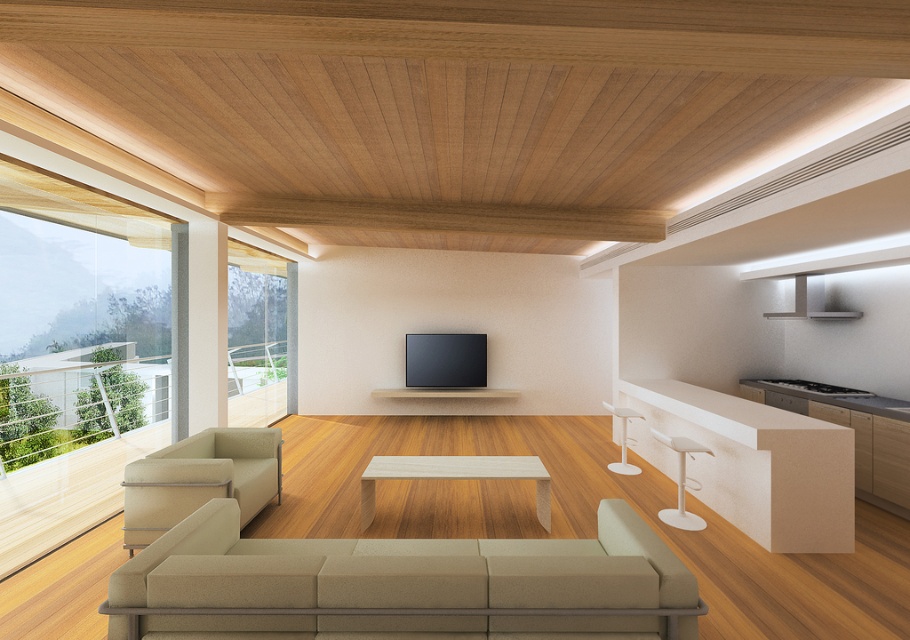
Is white matte bar counter at right above white plastic bar stool at right?

Yes, white matte bar counter at right is above white plastic bar stool at right.

Can you confirm if white matte bar counter at right is bigger than white plastic bar stool at right?

Yes, white matte bar counter at right is bigger than white plastic bar stool at right.

The height and width of the screenshot is (640, 910). I want to click on white matte bar counter at right, so [x=753, y=461].

Can you confirm if light wood/texture coffee table at center is taller than white glossy bar stool at right?

In fact, light wood/texture coffee table at center may be shorter than white glossy bar stool at right.

Which is more to the left, light wood/texture coffee table at center or white glossy bar stool at right?

light wood/texture coffee table at center

Image resolution: width=910 pixels, height=640 pixels. What are the coordinates of `light wood/texture coffee table at center` in the screenshot? It's located at [x=455, y=476].

Is white matte bar counter at right smaller than white glossy bar stool at right?

No.

Is white matte bar counter at right to the right of white glossy bar stool at right from the viewer's perspective?

Indeed, white matte bar counter at right is positioned on the right side of white glossy bar stool at right.

Who is more distant from viewer, [822,477] or [623,452]?

Positioned behind is point [623,452].

Locate an element on the screen. The height and width of the screenshot is (640, 910). white matte bar counter at right is located at coordinates (753, 461).